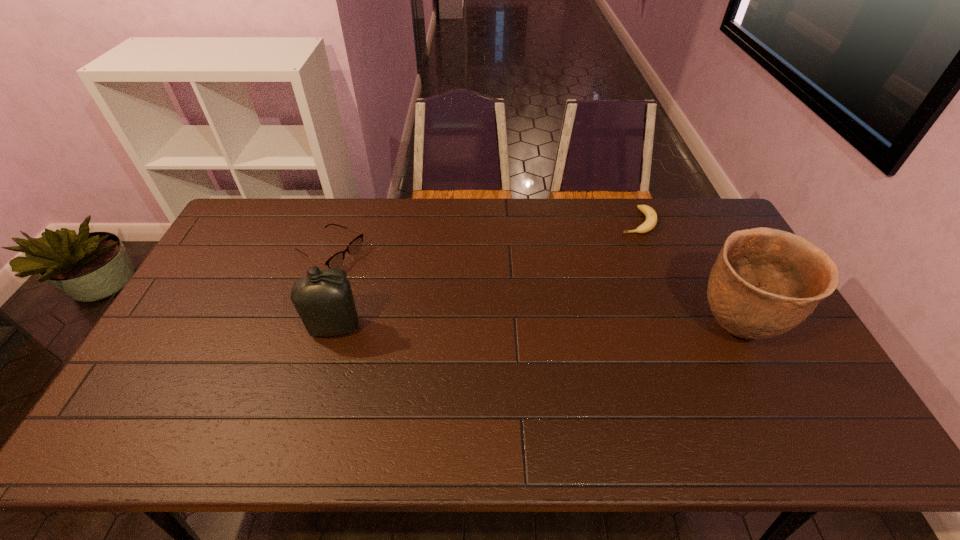
This screenshot has height=540, width=960. I want to click on vacant area between the banana and the pottery, so click(x=685, y=275).

The image size is (960, 540). I want to click on vacant space that's between the third shortest object and the pottery, so click(535, 328).

The image size is (960, 540). I want to click on vacant area between the shortest object and the bottle, so click(486, 275).

This screenshot has width=960, height=540. In order to click on vacant space that is in between the pottery and the shortest object in this screenshot , I will do `click(685, 275)`.

Where is `free spot between the banana and the second tallest object`? free spot between the banana and the second tallest object is located at coordinates (486, 275).

The height and width of the screenshot is (540, 960). I want to click on vacant space that's between the shortest object and the spectacles, so click(483, 237).

Select which object is the second closest to the second tallest object. Please provide its 2D coordinates. Your answer should be formatted as a tuple, i.e. [(x, y)], where the tuple contains the x and y coordinates of a point satisfying the conditions above.

[(651, 217)]

Where is `object that is the second closest to the bottle`? The image size is (960, 540). object that is the second closest to the bottle is located at coordinates (651, 217).

Identify the location of vacant region that satisfies the following two spatial constraints: 1. on the front side of the spectacles; 2. on the right side of the pottery. This screenshot has height=540, width=960. (303, 328).